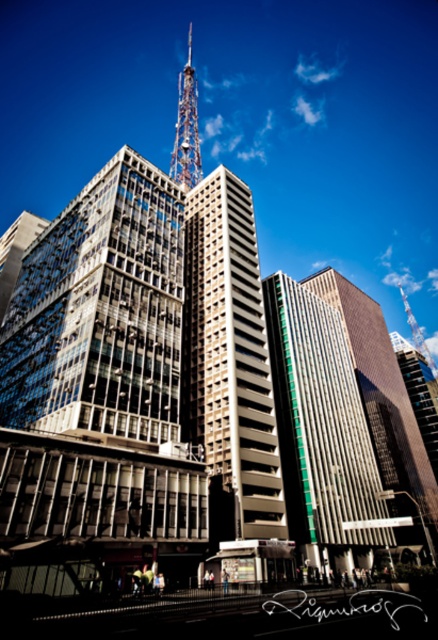
Question: Which point is closer to the camera?

Choices:
 (A) (194, 177)
 (B) (317, 513)
 (C) (253, 433)

Answer: (C)

Question: Which object is positioned closest to the green glass building at center?

Choices:
 (A) metallic lattice tower at upper center
 (B) metallic glass skyscraper at center

Answer: (B)

Question: From the image, what is the correct spatial relationship of metallic glass skyscraper at center in relation to green glass building at center?

Choices:
 (A) below
 (B) above

Answer: (B)

Question: Does metallic glass skyscraper at center have a smaller size compared to metallic lattice tower at upper center?

Choices:
 (A) no
 (B) yes

Answer: (B)

Question: Estimate the real-world distances between objects in this image. Which object is closer to the metallic glass skyscraper at center?

Choices:
 (A) metallic lattice tower at upper center
 (B) green glass building at center

Answer: (B)

Question: Is the position of metallic glass skyscraper at center more distant than that of green glass building at center?

Choices:
 (A) no
 (B) yes

Answer: (A)